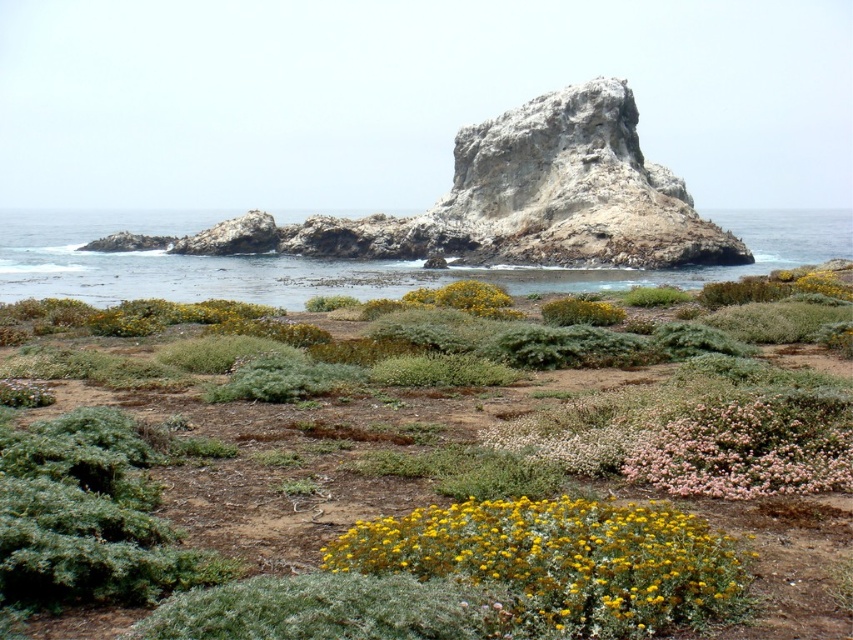
Question: Which point is closer to the camera?

Choices:
 (A) (805, 250)
 (B) (680, 556)
 (C) (770, 452)

Answer: (B)

Question: Is blue water at center closer to the viewer compared to pink fluffy bush at lower right?

Choices:
 (A) no
 (B) yes

Answer: (A)

Question: Can you confirm if blue water at center is smaller than pink fluffy bush at lower right?

Choices:
 (A) no
 (B) yes

Answer: (A)

Question: Which point is farther to the camera?

Choices:
 (A) (787, 456)
 (B) (74, 275)

Answer: (B)

Question: Which is nearer to the blue water at center?

Choices:
 (A) pink fluffy bush at lower right
 (B) yellow matte flower at lower center

Answer: (A)

Question: Is blue water at center bigger than pink fluffy bush at lower right?

Choices:
 (A) no
 (B) yes

Answer: (B)